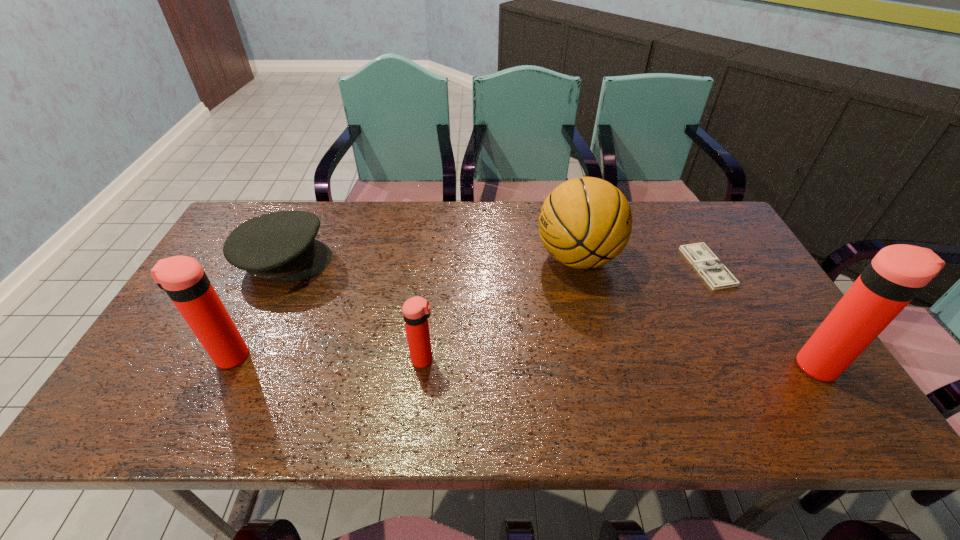
Locate an element on the screen. vacant space situated 0.240m on the left of the second thermos bottle from left to right is located at coordinates (311, 360).

Where is `free spot located on the left of the rightmost thermos bottle`? free spot located on the left of the rightmost thermos bottle is located at coordinates (646, 366).

At what (x,y) coordinates should I click in order to perform the action: click on free spot located on the surface of the fourth object from left to right near the brand logo. Please return your answer as a coordinate pair (x, y). Looking at the image, I should click on (502, 258).

Where is `vacant space located on the surface of the fourth object from left to right near the brand logo`? The height and width of the screenshot is (540, 960). vacant space located on the surface of the fourth object from left to right near the brand logo is located at coordinates (401, 258).

The height and width of the screenshot is (540, 960). I want to click on vacant region located on the surface of the fourth object from left to right near the brand logo, so [x=451, y=258].

Where is `vacant space located 0.250m on the front-facing side of the fifth tallest object`? The height and width of the screenshot is (540, 960). vacant space located 0.250m on the front-facing side of the fifth tallest object is located at coordinates (415, 260).

Locate an element on the screen. vacant space located 0.310m on the front of the dollar is located at coordinates (774, 388).

I want to click on basketball located at the far edge, so click(x=587, y=222).

The image size is (960, 540). In order to click on beret that is at the far edge in this screenshot , I will do `click(281, 246)`.

This screenshot has width=960, height=540. I want to click on dollar that is positioned at the far edge, so click(713, 271).